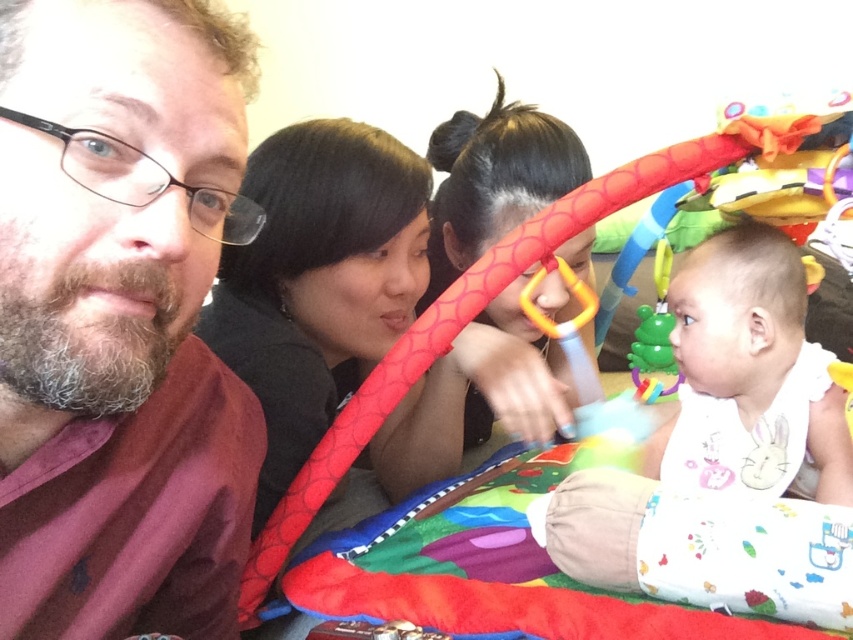
Question: Which of the following is the farthest from the observer?

Choices:
 (A) (802, 436)
 (B) (732, 230)

Answer: (B)

Question: Does white cotton bib at center have a greater width compared to white soft bib at lower right?

Choices:
 (A) yes
 (B) no

Answer: (A)

Question: Does matte red shirt at left appear over white soft bib at lower right?

Choices:
 (A) yes
 (B) no

Answer: (B)

Question: Which of the following is the closest to the observer?

Choices:
 (A) (711, 352)
 (B) (743, 349)

Answer: (B)

Question: In this image, where is matte red shirt at left located relative to white soft bib at lower right?

Choices:
 (A) right
 (B) left

Answer: (B)

Question: Which of these objects is positioned farthest from the matte red shirt at left?

Choices:
 (A) white cotton bib at center
 (B) white soft bib at lower right

Answer: (B)